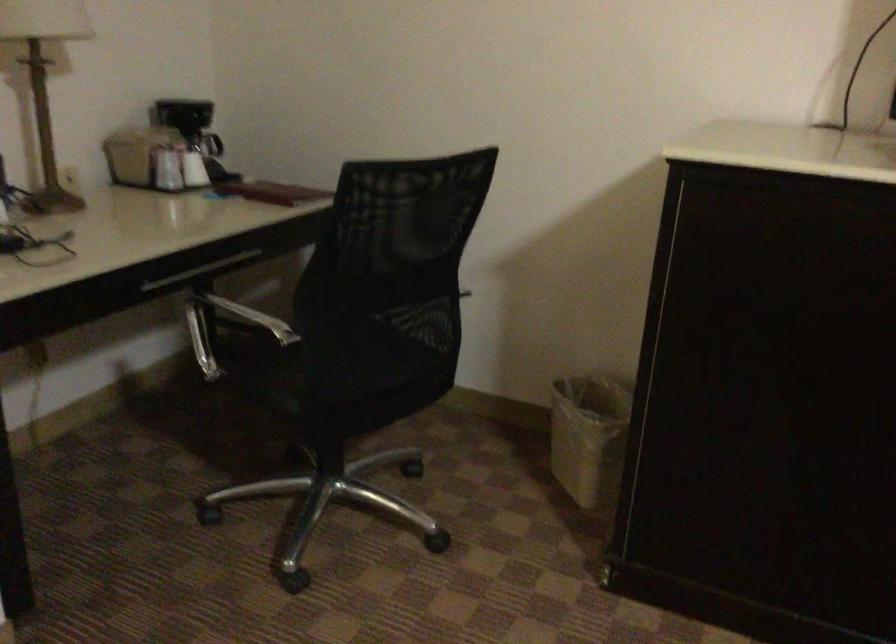
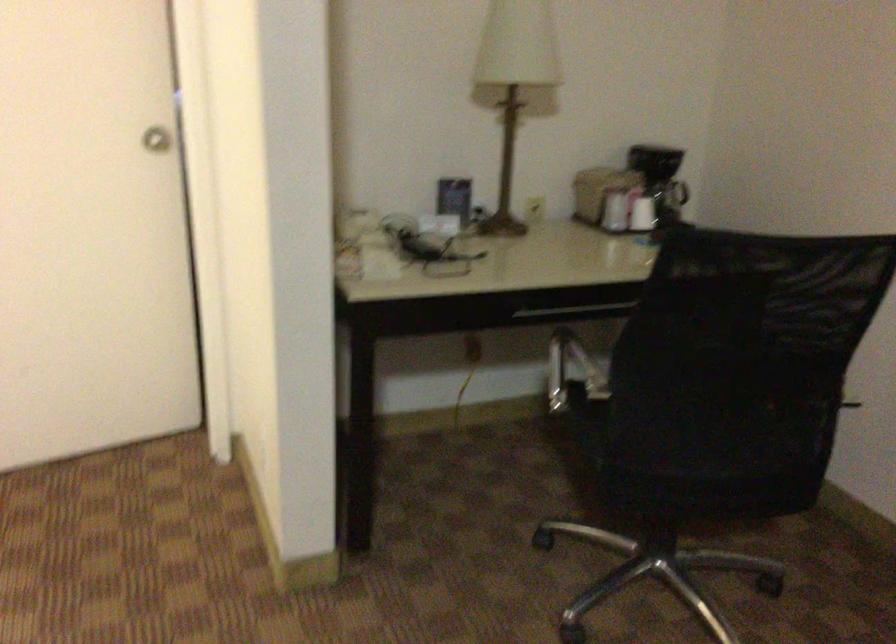
Question: Based on the continuous images, in which direction is the camera rotating? Reply with the corresponding letter.

Choices:
 (A) Left
 (B) Right
 (C) Up
 (D) Down

Answer: (A)